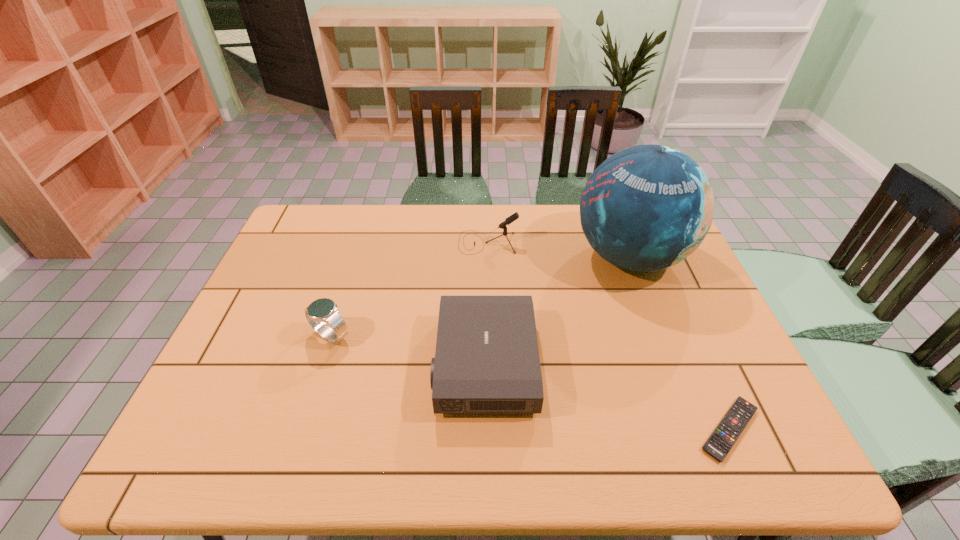
Locate an element on the screen. object situated at the near right corner is located at coordinates (720, 442).

You are a GUI agent. You are given a task and a screenshot of the screen. Output one action in this format:
    pyautogui.click(x=<x>, y=<y>)
    Task: Click on the vacant space at the far edge
    This screenshot has width=960, height=540.
    Given the screenshot: What is the action you would take?
    pyautogui.click(x=577, y=218)

At what (x,y) coordinates should I click in order to perform the action: click on free space at the near edge of the desktop. Please return your answer as a coordinate pair (x, y). The image size is (960, 540). Looking at the image, I should click on (378, 469).

In the image, there is a desktop. At what (x,y) coordinates should I click in order to perform the action: click on vacant space at the left edge. Please return your answer as a coordinate pair (x, y). This screenshot has width=960, height=540. Looking at the image, I should click on click(252, 369).

Where is `vacant space at the right edge of the desktop`? The width and height of the screenshot is (960, 540). vacant space at the right edge of the desktop is located at coordinates (722, 371).

Find the location of a particular element. The image size is (960, 540). free area in between the microphone and the tallest object is located at coordinates (559, 250).

Locate an element on the screen. free space that is in between the leftmost object and the microphone is located at coordinates (410, 289).

Locate an element on the screen. Image resolution: width=960 pixels, height=540 pixels. vacant space in between the microphone and the shortest object is located at coordinates (609, 336).

Find the location of a particular element. vacant area that lies between the globe and the remote control is located at coordinates (680, 343).

Locate an element on the screen. The image size is (960, 540). vacant space in between the projector and the tallest object is located at coordinates (557, 310).